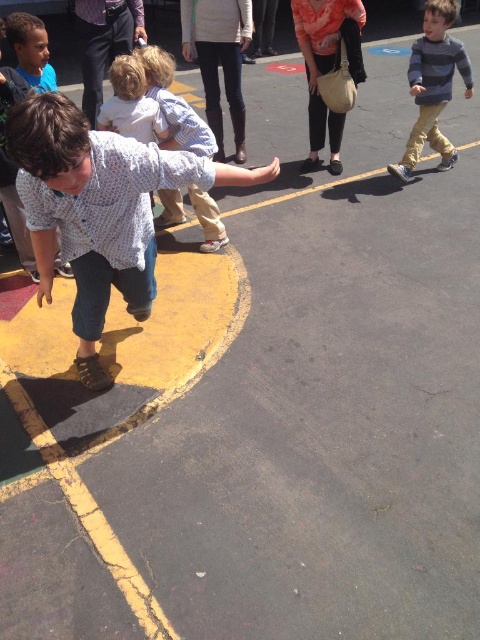
You are a parent trying to locate your child in a school event. You see the denim jeans at left and the striped cotton shirt at upper right in the image. Which one is closer to you?

The denim jeans at left is closer to you since it is 3.30 meters away from the striped cotton shirt at upper right, meaning the denim jeans at left is nearer in the scene.

You are a photographer standing at the center of the paved area marked with yellow lines. You want to capture a photo that includes both the young boy in the foreground and the denim jeans at left located at point (98, 211). Will you need to adjust your position to ensure both are in frame?

Yes, you need to adjust your position because the denim jeans at left is located at point (98, 211), which might be outside your current field of view if you are centered. Moving slightly towards the left could help include both the young boy and the denim jeans at left in the frame.

From the picture: You are standing at the center of the paved area marked with yellow lines. You want to find the striped cotton shirt at upper right. Which direction should you look to locate it?

The striped cotton shirt at upper right is located at point (432, 84), which is in the upper right direction from your current position at the center of the paved area marked with yellow lines.